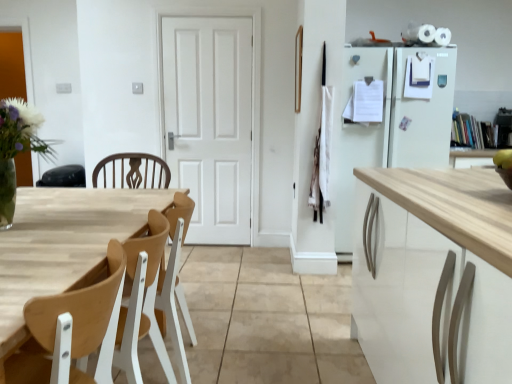
Question: Is wooden at left at the back of wooden table at left?

Choices:
 (A) no
 (B) yes

Answer: (A)

Question: Considering the relative sizes of wooden table at left and wooden at left in the image provided, is wooden table at left bigger than wooden at left?

Choices:
 (A) yes
 (B) no

Answer: (A)

Question: From a real-world perspective, is wooden table at left positioned under wooden at left based on gravity?

Choices:
 (A) no
 (B) yes

Answer: (B)

Question: Is wooden table at left at the left side of wooden at left?

Choices:
 (A) no
 (B) yes

Answer: (B)

Question: Does wooden table at left turn towards wooden at left?

Choices:
 (A) yes
 (B) no

Answer: (A)

Question: Is white matte door at center bigger or smaller than wooden table at left?

Choices:
 (A) big
 (B) small

Answer: (B)

Question: From a real-world perspective, relative to wooden table at left, is white matte door at center vertically above or below?

Choices:
 (A) below
 (B) above

Answer: (B)

Question: From the image's perspective, is white matte door at center positioned above or below wooden table at left?

Choices:
 (A) below
 (B) above

Answer: (B)

Question: Is point (190, 107) positioned closer to the camera than point (133, 195)?

Choices:
 (A) closer
 (B) farther

Answer: (B)

Question: Is point (196, 16) positioned closer to the camera than point (1, 122)?

Choices:
 (A) farther
 (B) closer

Answer: (A)

Question: In terms of height, does white matte door at center look taller or shorter compared to clear glass vase at left?

Choices:
 (A) tall
 (B) short

Answer: (A)

Question: Looking at the image, does white matte door at center seem bigger or smaller compared to clear glass vase at left?

Choices:
 (A) small
 (B) big

Answer: (B)

Question: Is white matte door at center to the left or to the right of clear glass vase at left in the image?

Choices:
 (A) left
 (B) right

Answer: (B)

Question: In terms of height, does wooden at left look taller or shorter compared to wooden table at left?

Choices:
 (A) short
 (B) tall

Answer: (A)

Question: Is wooden at left in front of or behind wooden table at left in the image?

Choices:
 (A) behind
 (B) front

Answer: (A)